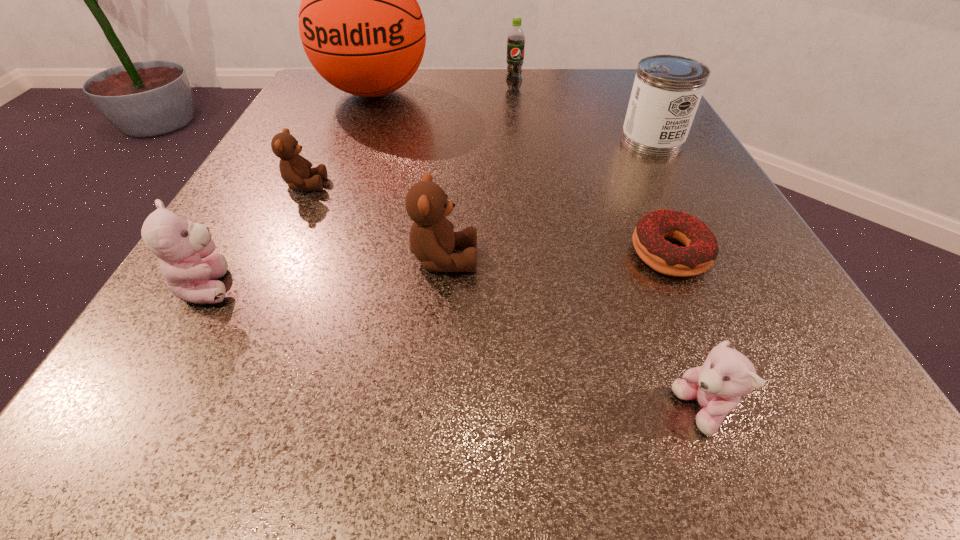
At what (x,y) coordinates should I click in order to perform the action: click on doughnut at the right edge. Please return your answer as a coordinate pair (x, y). Looking at the image, I should click on (701, 250).

This screenshot has height=540, width=960. What are the coordinates of `object positioned at the far left corner` in the screenshot? It's located at (361, 27).

Where is `object at the near right corner`? object at the near right corner is located at coordinates (726, 375).

In the image, there is a desktop. Where is `free region at the far edge`? Image resolution: width=960 pixels, height=540 pixels. free region at the far edge is located at coordinates (455, 82).

Locate an element on the screen. This screenshot has width=960, height=540. vacant space at the left edge of the desktop is located at coordinates (269, 204).

The image size is (960, 540). What are the coordinates of `vacant space at the right edge` in the screenshot? It's located at (601, 140).

You are a GUI agent. You are given a task and a screenshot of the screen. Output one action in this format:
    pyautogui.click(x=<x>, y=<y>)
    Task: Click on the vacant space at the far left corner
    
    Given the screenshot: What is the action you would take?
    pyautogui.click(x=334, y=89)

Where is `vacant space at the near left corner of the desktop`? vacant space at the near left corner of the desktop is located at coordinates (122, 460).

Locate an element on the screen. The image size is (960, 540). vacant point located between the fourth object from left to right and the left brown teddy bear is located at coordinates (374, 222).

I want to click on free spot between the doughnut and the right brown teddy bear, so click(557, 256).